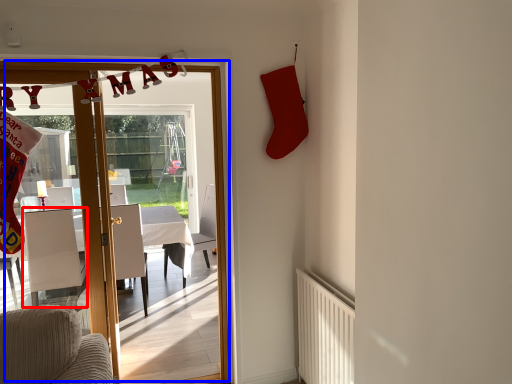
Question: Which of the following is the closest to the observer, armchair (highlighted by a red box) or door (highlighted by a blue box)?

Choices:
 (A) armchair
 (B) door

Answer: (B)